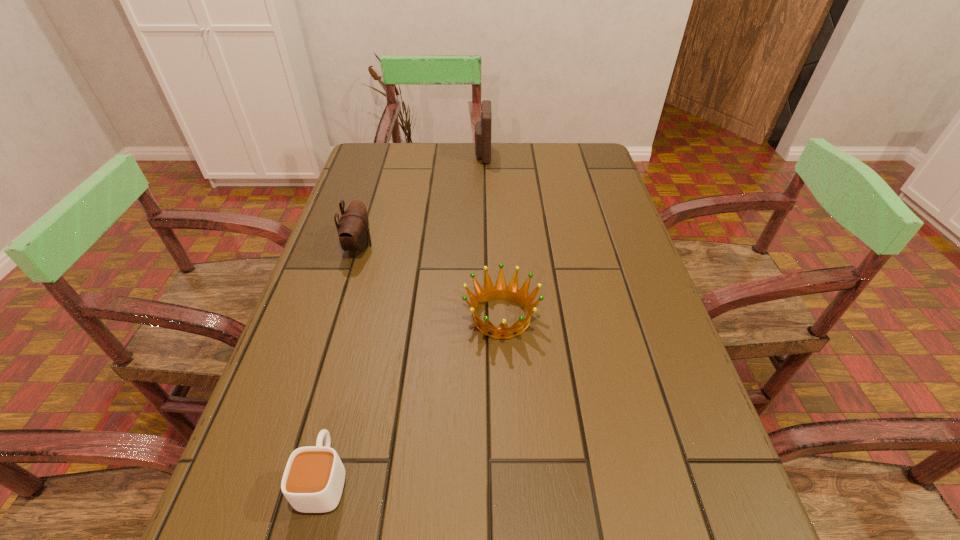
The image size is (960, 540). What are the coordinates of `free point between the farthest object and the cup` in the screenshot? It's located at (403, 316).

Choose which object is the second nearest neighbor to the shorter pouch. Please provide its 2D coordinates. Your answer should be formatted as a tuple, i.e. [(x, y)], where the tuple contains the x and y coordinates of a point satisfying the conditions above.

[(482, 136)]

The image size is (960, 540). I want to click on the closest object to the nearest object, so click(x=501, y=291).

Identify the location of vacant space that satisfies the following two spatial constraints: 1. with the flap open on the crown; 2. on the right side of the nearer pouch. The image size is (960, 540). (338, 317).

Where is `free location that satisfies the following two spatial constraints: 1. on the side with the handle of the nearest object; 2. on the right side of the third farthest object`? This screenshot has height=540, width=960. free location that satisfies the following two spatial constraints: 1. on the side with the handle of the nearest object; 2. on the right side of the third farthest object is located at coordinates (364, 317).

You are a GUI agent. You are given a task and a screenshot of the screen. Output one action in this format:
    pyautogui.click(x=<x>, y=<y>)
    Task: Click on the vacant region that satisfies the following two spatial constraints: 1. with an open flap on the second nearest object; 2. on the left side of the right pouch
    This screenshot has width=960, height=540.
    Given the screenshot: What is the action you would take?
    (x=484, y=317)

Identify the location of free space that satisfies the following two spatial constraints: 1. with an open flap on the crown; 2. on the right side of the right pouch. This screenshot has height=540, width=960. (484, 317).

Where is `free point that satisfies the following two spatial constraints: 1. on the back side of the third farthest object; 2. with an open flap on the right pouch`? This screenshot has height=540, width=960. free point that satisfies the following two spatial constraints: 1. on the back side of the third farthest object; 2. with an open flap on the right pouch is located at coordinates (494, 155).

Locate an element on the screen. free point that satisfies the following two spatial constraints: 1. with an open flap on the second nearest object; 2. on the right side of the farthest object is located at coordinates (484, 317).

The image size is (960, 540). Find the location of `vacant position in the image that satisfies the following two spatial constraints: 1. with the flap open on the nearer pouch; 2. on the side with the handle of the cup`. vacant position in the image that satisfies the following two spatial constraints: 1. with the flap open on the nearer pouch; 2. on the side with the handle of the cup is located at coordinates (288, 477).